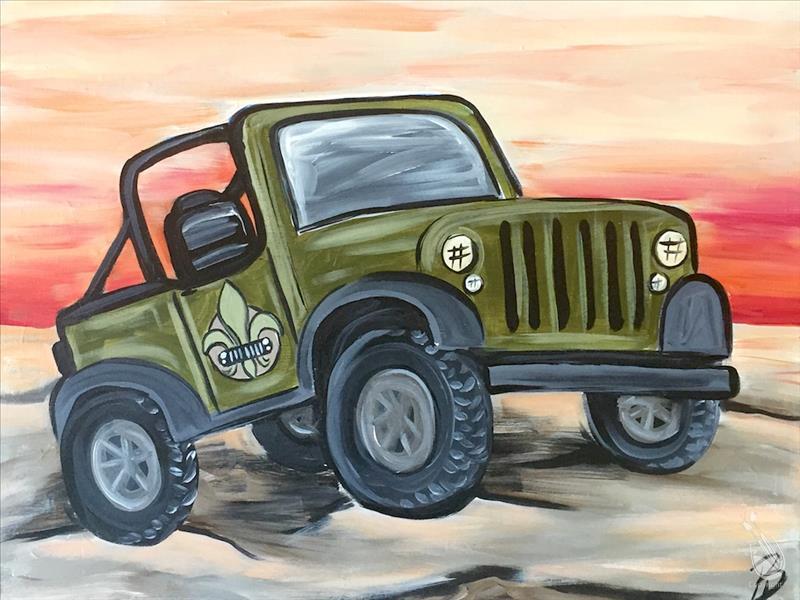
Where is `space around seat`? This screenshot has width=800, height=600. space around seat is located at coordinates (186, 174), (242, 197), (157, 252).